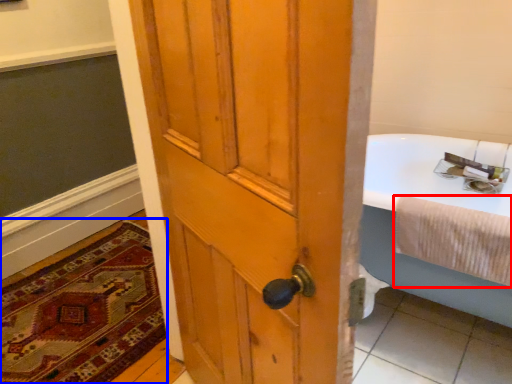
Question: Which object appears farthest to the camera in this image, bath towel (highlighted by a red box) or mat (highlighted by a blue box)?

Choices:
 (A) bath towel
 (B) mat

Answer: (B)